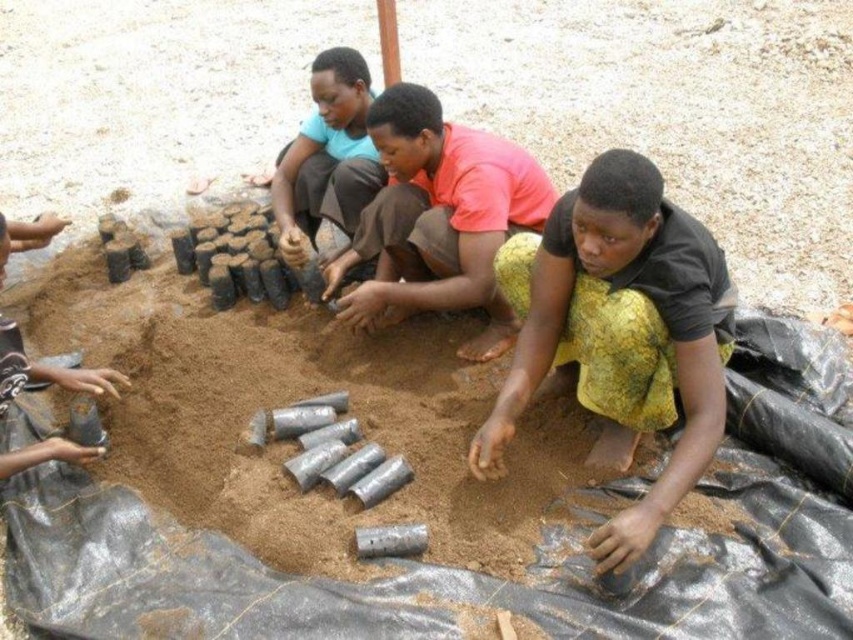
You are a photographer trying to capture a clear shot of the pink matte shirt at center without the matte brown shirt at center blocking it. Based on their positions, is this possible?

The pink matte shirt at center is positioned under the matte brown shirt at center, so it is likely blocked and not visible in the shot.

You are a photographer trying to capture a group photo of the people and objects in the scene. You want to ensure that both the matte brown shirt at center and the matte black pot at lower left are clearly visible in the frame. Given their sizes, which object should you focus on first to ensure proper framing?

The matte brown shirt at center is wider than the matte black pot at lower left, so focusing on the matte brown shirt at center first will help ensure proper framing for both objects.